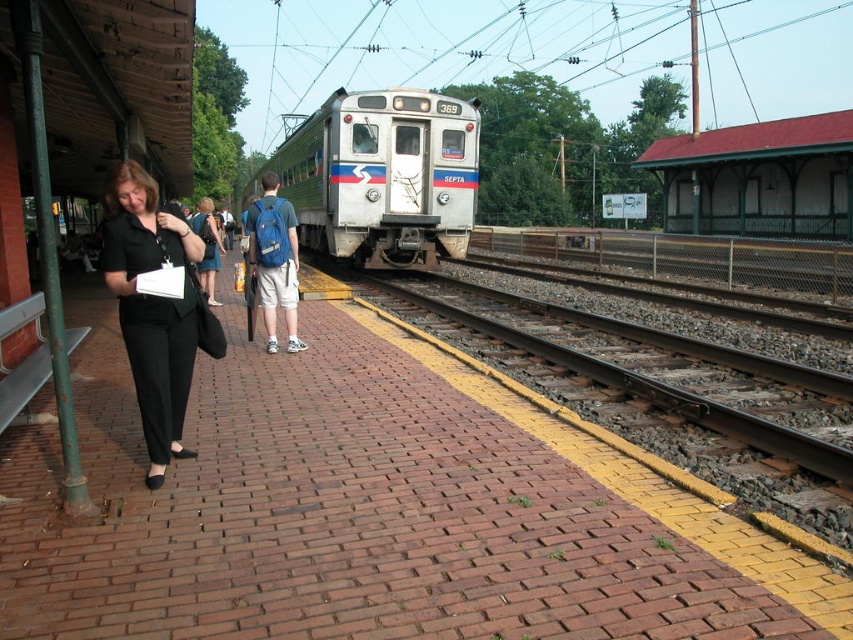
You are standing on the train station platform and want to walk from point [788,451] to point [268,180]. Which direction should you move in to get closer to the train?

To move from point [788,451] to point [268,180], you should move towards the train since point [268,180] is further away from the viewer than point [788,451]. The train is in the background, so moving towards it would take you in the correct direction.

You are a photographer standing on the train station platform. You want to capture a photo of the smooth metal train track at center and denim shorts at center. Which object should you focus on if you want to include both in the frame without cropping?

The smooth metal train track at center occupies less space than denim shorts at center, so you should focus on the denim shorts at center to ensure both objects fit in the frame.

You are standing on the train station platform and see the smooth metal train track at center and the denim shorts at center. Which object is located to the left of the other?

The denim shorts at center is located to the left of the smooth metal train track at center because the smooth metal train track at center is positioned on the right side of denim shorts at center.